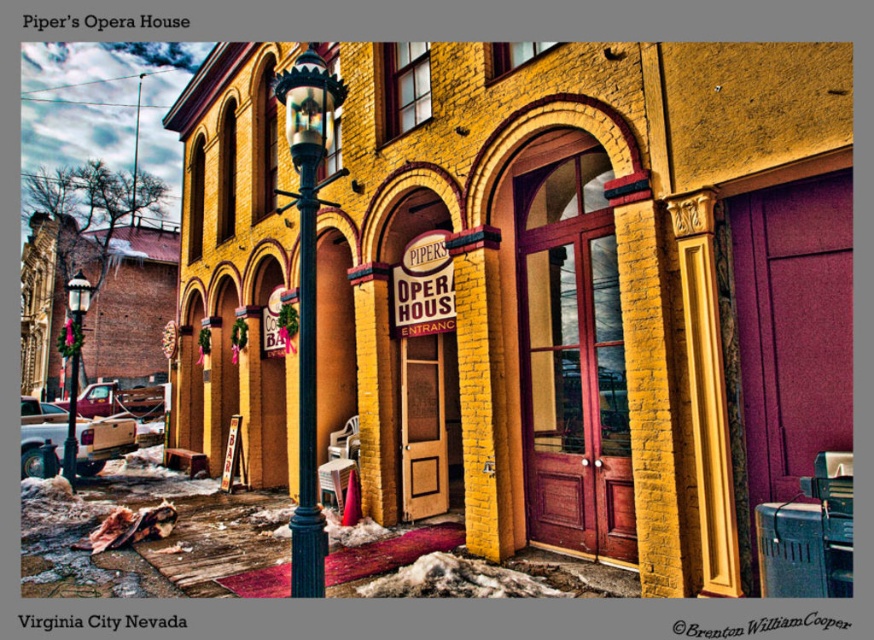
Question: Which point is farther to the camera?

Choices:
 (A) green painted metal pole at center
 (B) metallic streetlamp at center-left
 (C) yellow brick building at center

Answer: (B)

Question: Which of the following is the closest to the observer?

Choices:
 (A) pos(66,460)
 (B) pos(316,515)
 (C) pos(300,380)
 (D) pos(68,305)

Answer: (B)

Question: Can you confirm if green painted metal pole at center is wider than matte black lamp post at left?

Choices:
 (A) no
 (B) yes

Answer: (A)

Question: Does green painted metal streetlamp at center have a lesser width compared to green painted metal pole at center?

Choices:
 (A) yes
 (B) no

Answer: (B)

Question: Among these points, which one is nearest to the camera?

Choices:
 (A) (252, 163)
 (B) (307, 268)

Answer: (B)

Question: Can you confirm if yellow brick building at center is wider than green painted metal pole at center?

Choices:
 (A) no
 (B) yes

Answer: (B)